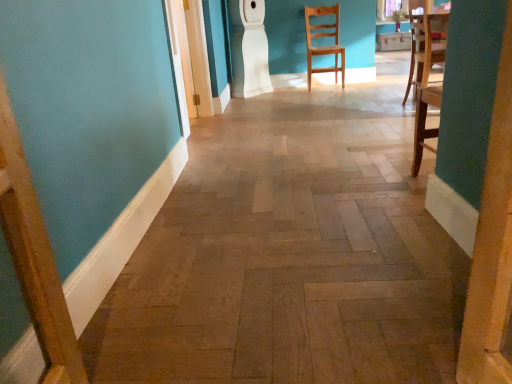
The width and height of the screenshot is (512, 384). What do you see at coordinates (324, 36) in the screenshot? I see `light brown wood chair at upper right` at bounding box center [324, 36].

This screenshot has width=512, height=384. I want to click on light brown wood chair at upper right, so click(324, 36).

Locate an element on the screen. light brown wood chair at upper right is located at coordinates (324, 36).